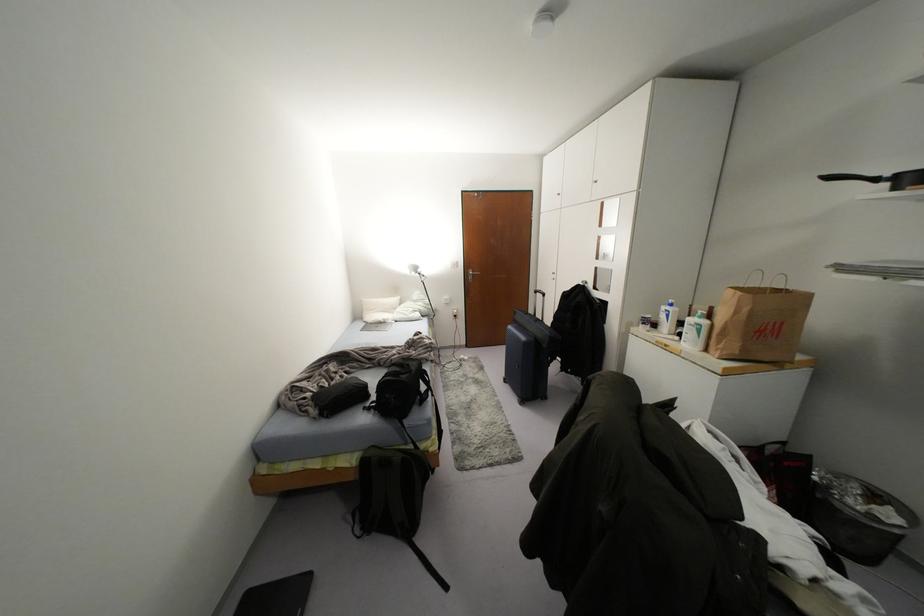
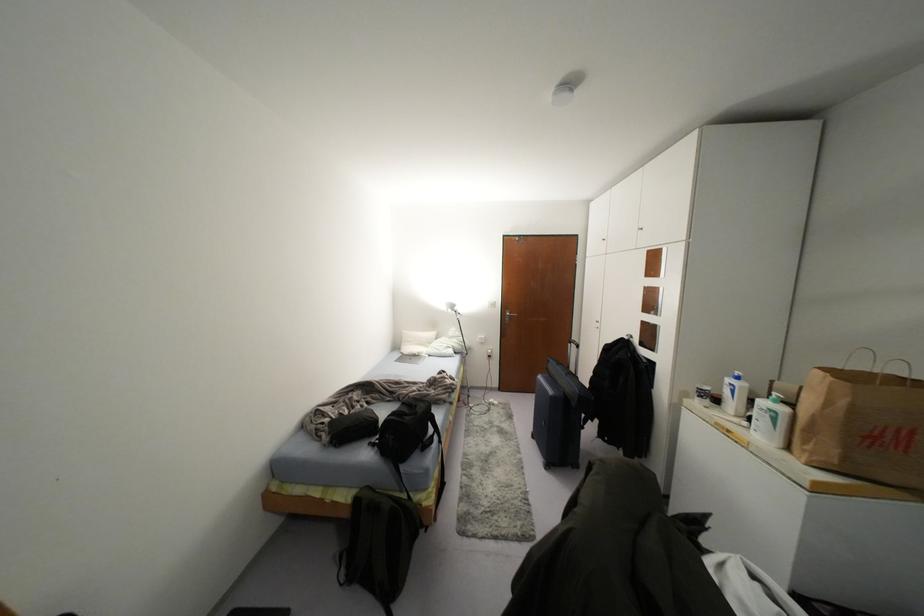
Question: Which direction would the cameraman need to move to produce the second image? Reply with the corresponding letter.

Choices:
 (A) Left
 (B) Right
 (C) Forward
 (D) Backward

Answer: (B)